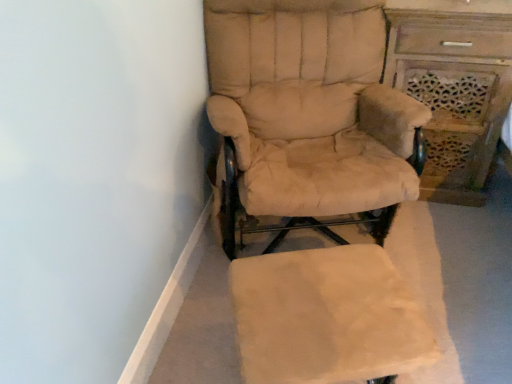
Question: From a real-world perspective, is beige fabric chair at center over beige fabric ottoman at lower center?

Choices:
 (A) yes
 (B) no

Answer: (A)

Question: Would you consider beige fabric chair at center to be distant from beige fabric ottoman at lower center?

Choices:
 (A) yes
 (B) no

Answer: (B)

Question: Is beige fabric chair at center shorter than beige fabric ottoman at lower center?

Choices:
 (A) no
 (B) yes

Answer: (A)

Question: Does beige fabric chair at center have a greater height compared to beige fabric ottoman at lower center?

Choices:
 (A) yes
 (B) no

Answer: (A)

Question: Is beige fabric chair at center thinner than beige fabric ottoman at lower center?

Choices:
 (A) no
 (B) yes

Answer: (A)

Question: Is point (318, 307) closer or farther from the camera than point (354, 167)?

Choices:
 (A) closer
 (B) farther

Answer: (A)

Question: Considering the positions of beige fabric ottoman at lower center and beige fabric chair at center in the image, is beige fabric ottoman at lower center bigger or smaller than beige fabric chair at center?

Choices:
 (A) small
 (B) big

Answer: (A)

Question: Is beige fabric ottoman at lower center in front of or behind beige fabric chair at center in the image?

Choices:
 (A) front
 (B) behind

Answer: (A)

Question: In terms of height, does beige fabric ottoman at lower center look taller or shorter compared to beige fabric chair at center?

Choices:
 (A) tall
 (B) short

Answer: (B)

Question: Considering their positions, is beige fabric chair at center located in front of or behind beige fabric ottoman at lower center?

Choices:
 (A) behind
 (B) front

Answer: (A)

Question: In terms of height, does beige fabric chair at center look taller or shorter compared to beige fabric ottoman at lower center?

Choices:
 (A) short
 (B) tall

Answer: (B)

Question: Considering the positions of beige fabric chair at center and beige fabric ottoman at lower center in the image, is beige fabric chair at center wider or thinner than beige fabric ottoman at lower center?

Choices:
 (A) wide
 (B) thin

Answer: (A)

Question: From the image's perspective, is beige fabric chair at center located above or below beige fabric ottoman at lower center?

Choices:
 (A) below
 (B) above

Answer: (B)

Question: Is wooden carved vanity at right wider or thinner than beige fabric chair at center?

Choices:
 (A) thin
 (B) wide

Answer: (A)

Question: In the image, is wooden carved vanity at right positioned in front of or behind beige fabric chair at center?

Choices:
 (A) behind
 (B) front

Answer: (A)